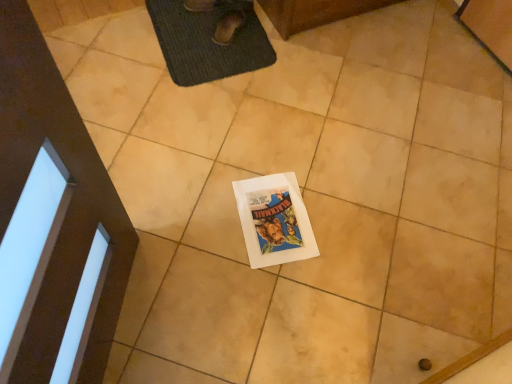
Question: From a real-world perspective, is white paper comic book at center located higher than dark gray textured bath mat at upper center?

Choices:
 (A) no
 (B) yes

Answer: (A)

Question: Considering the relative sizes of white paper comic book at center and dark gray textured bath mat at upper center in the image provided, is white paper comic book at center taller than dark gray textured bath mat at upper center?

Choices:
 (A) no
 (B) yes

Answer: (A)

Question: From the image's perspective, is white paper comic book at center located beneath dark gray textured bath mat at upper center?

Choices:
 (A) no
 (B) yes

Answer: (B)

Question: Can dark gray textured bath mat at upper center be found inside white paper comic book at center?

Choices:
 (A) yes
 (B) no

Answer: (B)

Question: Could you tell me if white paper comic book at center is facing dark gray textured bath mat at upper center?

Choices:
 (A) no
 (B) yes

Answer: (B)

Question: Is white paper comic book at center smaller than dark gray textured bath mat at upper center?

Choices:
 (A) no
 (B) yes

Answer: (B)

Question: Can you confirm if brown suede shoe at upper center is bigger than white paper comic book at center?

Choices:
 (A) no
 (B) yes

Answer: (B)

Question: Can you confirm if brown suede shoe at upper center is taller than white paper comic book at center?

Choices:
 (A) no
 (B) yes

Answer: (B)

Question: From the image's perspective, would you say brown suede shoe at upper center is positioned over white paper comic book at center?

Choices:
 (A) no
 (B) yes

Answer: (B)

Question: Is there a large distance between brown suede shoe at upper center and white paper comic book at center?

Choices:
 (A) no
 (B) yes

Answer: (A)

Question: From a real-world perspective, is brown suede shoe at upper center positioned under white paper comic book at center based on gravity?

Choices:
 (A) no
 (B) yes

Answer: (A)

Question: Is brown suede shoe at upper center positioned before white paper comic book at center?

Choices:
 (A) yes
 (B) no

Answer: (B)

Question: Does dark gray textured bath mat at upper center come in front of brown suede shoe at upper center?

Choices:
 (A) no
 (B) yes

Answer: (B)